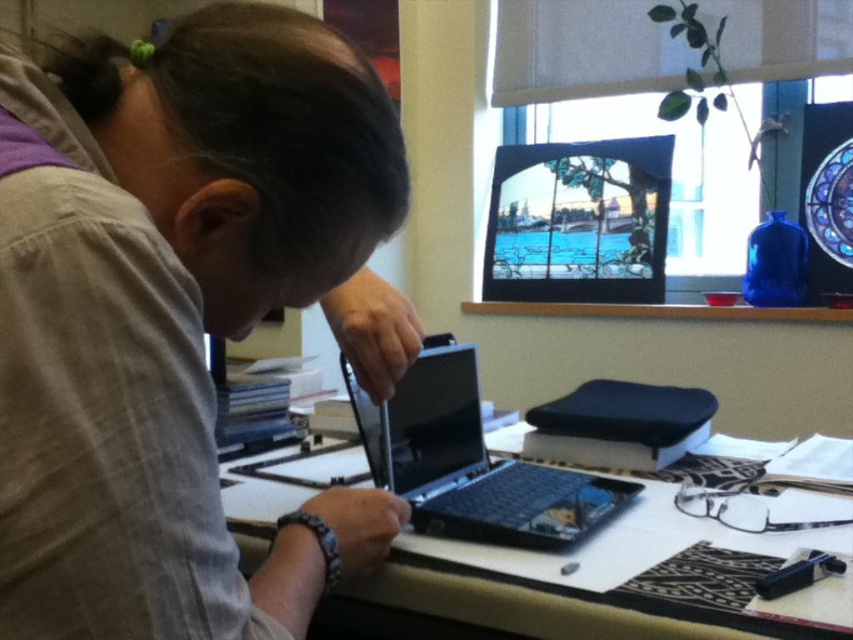
You are organizing a desk and need to ensure that the matte glass computer screen at upper center and the smooth wooden table at center fit through a doorway that is 1.2 meters wide. Based on their sizes, can both items fit side by side?

The matte glass computer screen at upper center has a lesser width compared to the smooth wooden table at center. However, without knowing the exact widths of both items, it is impossible to determine if they can fit side by side through a 1.2 meters wide doorway.

You are a delivery person who needs to place a package that is 5 feet long on the smooth wooden table at center. Can the package fit on the table if the matte glass computer screen at upper center is already occupying space above it?

The distance between the matte glass computer screen at upper center and the smooth wooden table at center is 5.14 feet. Since the package is 5 feet long, it can fit on the table as the vertical space available is sufficient.

You are a person who needs to reach for an item on the desk. You see the black plastic laptop at center and the matte glass computer screen at upper center. Which one is physically closer to you?

The black plastic laptop at center is closer to the viewer than the matte glass computer screen at upper center.